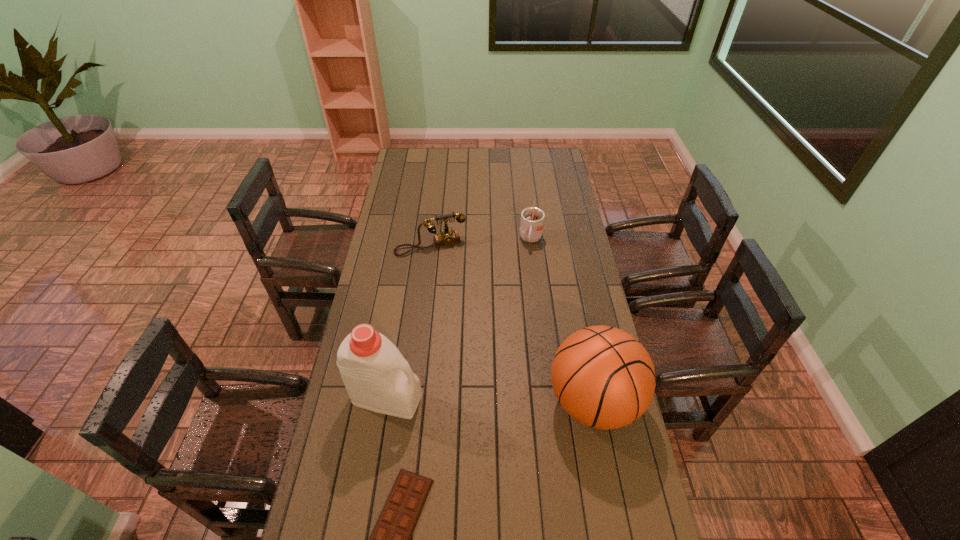
In order to click on basketball in this screenshot , I will do `click(603, 377)`.

At what (x,y) coordinates should I click in order to perform the action: click on telephone. Please return your answer as a coordinate pair (x, y). The image size is (960, 540). Looking at the image, I should click on (447, 237).

Find the location of a particular element. This screenshot has height=540, width=960. cup is located at coordinates (532, 219).

You are a GUI agent. You are given a task and a screenshot of the screen. Output one action in this format:
    pyautogui.click(x=<x>, y=<y>)
    Task: Click on the detergent
    Image resolution: width=960 pixels, height=540 pixels.
    Given the screenshot: What is the action you would take?
    pyautogui.click(x=377, y=377)

Find the location of a particular element. vacant region located on the back of the basketball is located at coordinates (582, 345).

Locate an element on the screen. vacant space situated 0.110m on the front-facing side of the telephone is located at coordinates (447, 274).

Where is `vacant space located 0.200m on the front-facing side of the telephone`? vacant space located 0.200m on the front-facing side of the telephone is located at coordinates (452, 289).

Find the location of a particular element. vacant space situated 0.110m on the front-facing side of the telephone is located at coordinates (447, 274).

In order to click on vacant space located 0.160m on the side with the handle of the cup in this screenshot , I will do `click(526, 277)`.

What are the coordinates of `free spot located 0.100m on the side with the handle of the cup` in the screenshot? It's located at (528, 267).